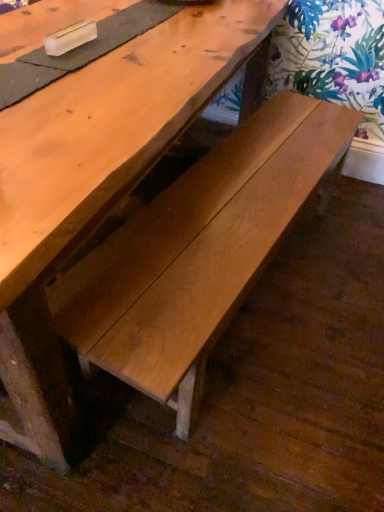
Where is `free space above light brown wood bench at center (from a real-world perspective)`? The image size is (384, 512). free space above light brown wood bench at center (from a real-world perspective) is located at coordinates (233, 193).